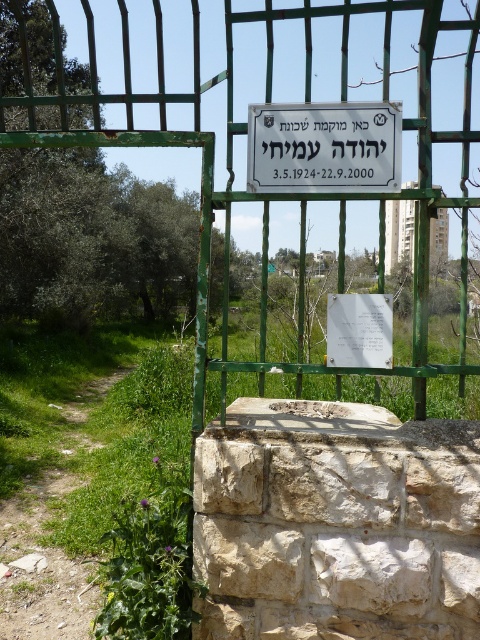
Question: Which point appears farthest from the camera in this image?

Choices:
 (A) (248, 160)
 (B) (71, 420)

Answer: (B)

Question: In this image, where is green metal gate at center located relative to white paper at center?

Choices:
 (A) below
 (B) above

Answer: (B)

Question: Among these objects, which one is farthest from the camera?

Choices:
 (A) white paper at center
 (B) green metal gate at center
 (C) green grassy path at lower left

Answer: (C)

Question: Which object appears closest to the camera in this image?

Choices:
 (A) white plastic sign at center
 (B) green grassy path at lower left

Answer: (A)

Question: Does white plastic sign at center come in front of white paper at center?

Choices:
 (A) yes
 (B) no

Answer: (B)

Question: Can you confirm if green metal gate at center is positioned above green grassy path at lower left?

Choices:
 (A) yes
 (B) no

Answer: (A)